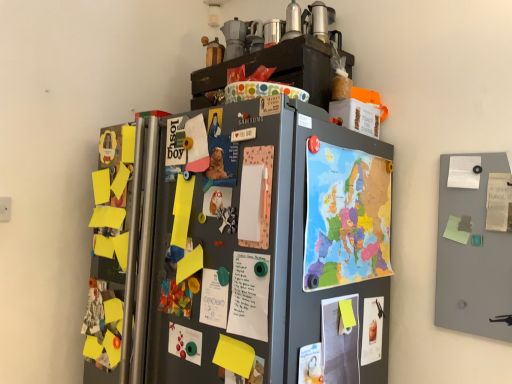
Question: Considering the relative positions of matte paper poster at lower right, marked as the second poster in a right-to-left arrangement, and matte white poster at lower center, placed as the 4th poster when sorted from left to right, in the image provided, is matte paper poster at lower right, marked as the second poster in a right-to-left arrangement, in front of matte white poster at lower center, placed as the 4th poster when sorted from left to right,?

Choices:
 (A) yes
 (B) no

Answer: (B)

Question: Does matte paper poster at lower right, marked as the second poster in a right-to-left arrangement, have a greater width compared to matte white poster at lower center, which is the third poster from right to left?

Choices:
 (A) yes
 (B) no

Answer: (B)

Question: Is matte paper poster at lower right, the fifth poster when ordered from left to right, oriented away from matte white poster at lower center, placed as the 4th poster when sorted from left to right?

Choices:
 (A) no
 (B) yes

Answer: (A)

Question: Does matte paper poster at lower right, the fifth poster when ordered from left to right, have a larger size compared to matte white poster at lower center, placed as the 4th poster when sorted from left to right?

Choices:
 (A) yes
 (B) no

Answer: (B)

Question: Considering the relative sizes of matte paper poster at lower right, the fifth poster when ordered from left to right, and matte white poster at lower center, which is the third poster from right to left, in the image provided, is matte paper poster at lower right, the fifth poster when ordered from left to right, shorter than matte white poster at lower center, which is the third poster from right to left,?

Choices:
 (A) yes
 (B) no

Answer: (A)

Question: Considering the positions of matte white poster at lower center, which is the third poster from right to left, and matte paper poster at right, positioned as the sixth poster in left-to-right order, in the image, is matte white poster at lower center, which is the third poster from right to left, taller or shorter than matte paper poster at right, positioned as the sixth poster in left-to-right order,?

Choices:
 (A) short
 (B) tall

Answer: (B)

Question: In the image, is matte white poster at lower center, which is the third poster from right to left, positioned in front of or behind matte paper poster at right, the first poster when ordered from right to left?

Choices:
 (A) behind
 (B) front

Answer: (B)

Question: Is matte white poster at lower center, placed as the 4th poster when sorted from left to right, wider or thinner than matte paper poster at right, positioned as the sixth poster in left-to-right order?

Choices:
 (A) wide
 (B) thin

Answer: (B)

Question: Considering the positions of point (308, 352) and point (495, 185), is point (308, 352) closer or farther from the camera than point (495, 185)?

Choices:
 (A) closer
 (B) farther

Answer: (A)

Question: Looking at the image, does matte white poster at lower center, placed as the 4th poster when sorted from left to right, seem bigger or smaller compared to matte paper poster at lower left, which is the sixth poster from right to left?

Choices:
 (A) small
 (B) big

Answer: (B)

Question: Is point (321, 369) closer or farther from the camera than point (197, 352)?

Choices:
 (A) farther
 (B) closer

Answer: (B)

Question: Is matte white poster at lower center, placed as the 4th poster when sorted from left to right, to the left or to the right of matte paper poster at lower left, marked as the 1th poster in a left-to-right arrangement, in the image?

Choices:
 (A) right
 (B) left

Answer: (A)

Question: Is matte white poster at lower center, placed as the 4th poster when sorted from left to right, situated inside matte paper poster at lower left, marked as the 1th poster in a left-to-right arrangement, or outside?

Choices:
 (A) outside
 (B) inside

Answer: (A)

Question: From a real-world perspective, is matte white poster at lower center, placed as the 4th poster when sorted from left to right, above or below smooth gray board at right?

Choices:
 (A) below
 (B) above

Answer: (A)

Question: From their relative heights in the image, would you say matte white poster at lower center, which is the third poster from right to left, is taller or shorter than smooth gray board at right?

Choices:
 (A) tall
 (B) short

Answer: (B)